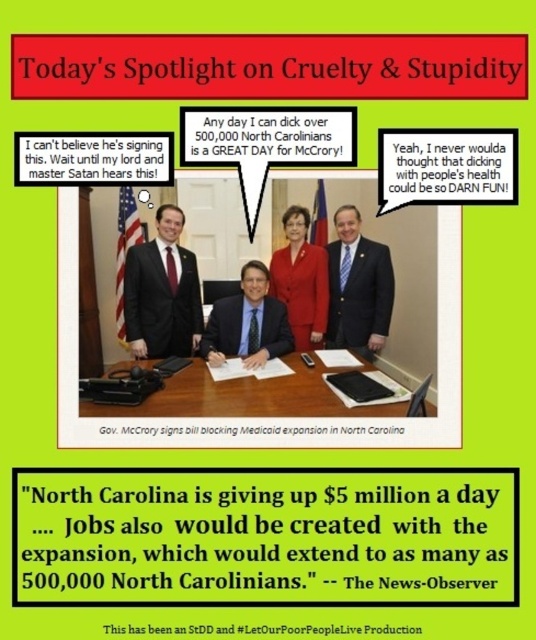
Question: Is blue suit at center smaller than matte blue suit at center?

Choices:
 (A) no
 (B) yes

Answer: (B)

Question: Does matte blue suit at center come in front of matte red suit at center?

Choices:
 (A) yes
 (B) no

Answer: (A)

Question: Which point is closer to the camera?

Choices:
 (A) matte red suit at center
 (B) matte black suit at center

Answer: (A)

Question: Is the position of white paper at center more distant than that of blue suit at center?

Choices:
 (A) no
 (B) yes

Answer: (A)

Question: Which of the following is the farthest from the observer?

Choices:
 (A) blue suit at center
 (B) matte blue suit at center
 (C) matte red suit at center

Answer: (A)

Question: Which object is positioned closest to the matte black suit at center?

Choices:
 (A) white paper at center
 (B) matte blue suit at center

Answer: (B)